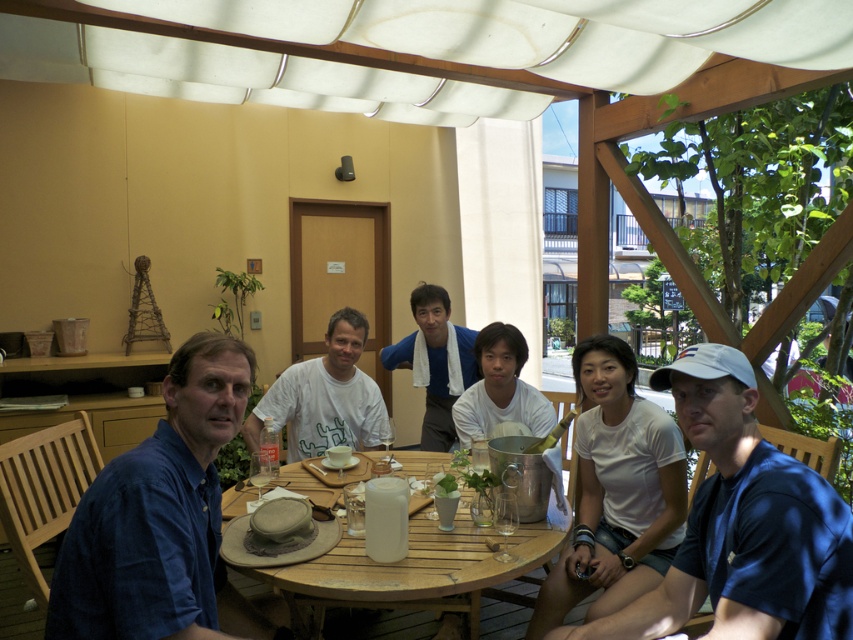
Which of these two, blue fabric cap at right or blue cotton shirt at left, stands shorter?

blue fabric cap at right is shorter.

From the picture: Who is more distant from viewer, (688, 356) or (204, 435)?

The point (204, 435) is more distant.

The width and height of the screenshot is (853, 640). Find the location of `blue fabric cap at right`. blue fabric cap at right is located at coordinates 740,525.

This screenshot has width=853, height=640. Identify the location of blue fabric cap at right. (740, 525).

Is blue fabric cap at right smaller than white cotton shirt at center?

Actually, blue fabric cap at right might be larger than white cotton shirt at center.

Is blue fabric cap at right bigger than white cotton shirt at center?

Indeed, blue fabric cap at right has a larger size compared to white cotton shirt at center.

Does point (831, 488) come farther from viewer compared to point (318, 376)?

That is False.

Where is `blue fabric cap at right`? blue fabric cap at right is located at coordinates (740, 525).

Between point (242, 374) and point (364, 579), which one is positioned behind?

Point (364, 579)

Which is more to the left, blue cotton shirt at left or wooden at center?

blue cotton shirt at left

Find the location of a particular element. The height and width of the screenshot is (640, 853). blue cotton shirt at left is located at coordinates (157, 513).

Identify the location of blue cotton shirt at left. (157, 513).